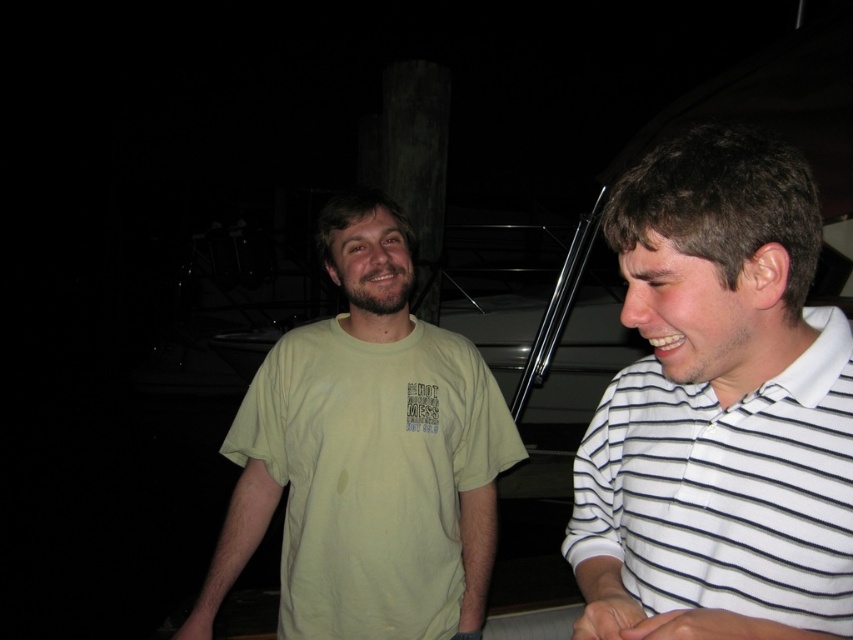
Does point (671, 538) lie behind point (421, 353)?

No, (671, 538) is in front of (421, 353).

Between point (750, 385) and point (421, 384), which one is positioned in front?

Point (750, 385) is in front.

Identify the location of white striped polo shirt at right. This screenshot has width=853, height=640. pos(718,410).